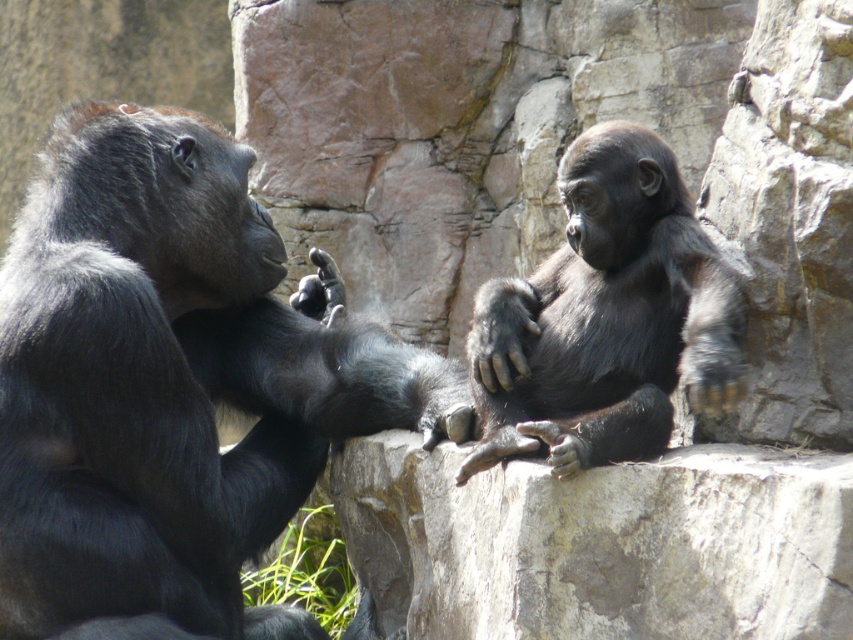
Question: Where is shiny black gorilla at left located in relation to shiny black gorilla at center in the image?

Choices:
 (A) below
 (B) above

Answer: (A)

Question: Which point is closer to the camera?

Choices:
 (A) coord(669,358)
 (B) coord(71,440)

Answer: (A)

Question: Is the position of shiny black gorilla at left less distant than that of shiny black gorilla at center?

Choices:
 (A) no
 (B) yes

Answer: (A)

Question: Considering the relative positions of shiny black gorilla at left and shiny black gorilla at center in the image provided, where is shiny black gorilla at left located with respect to shiny black gorilla at center?

Choices:
 (A) right
 (B) left

Answer: (B)